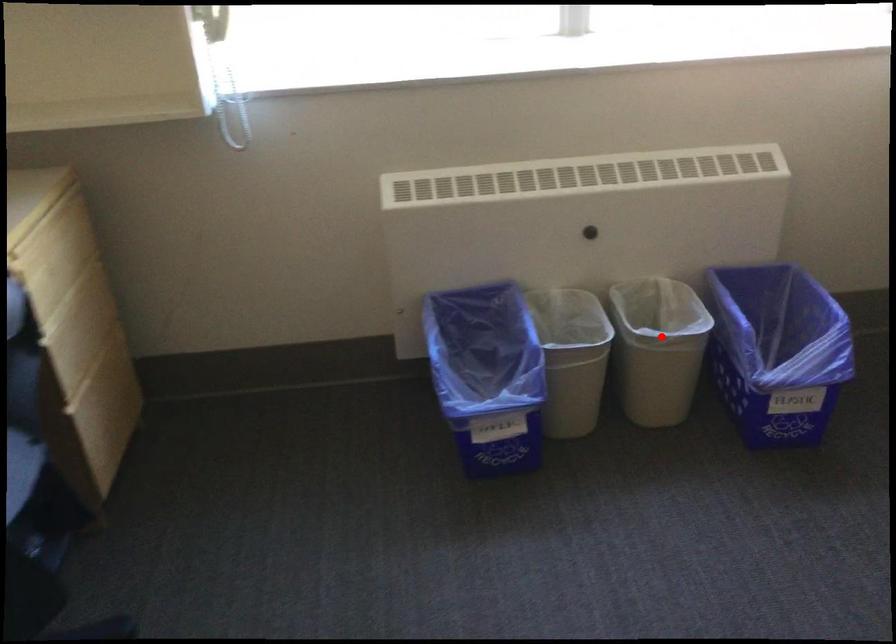
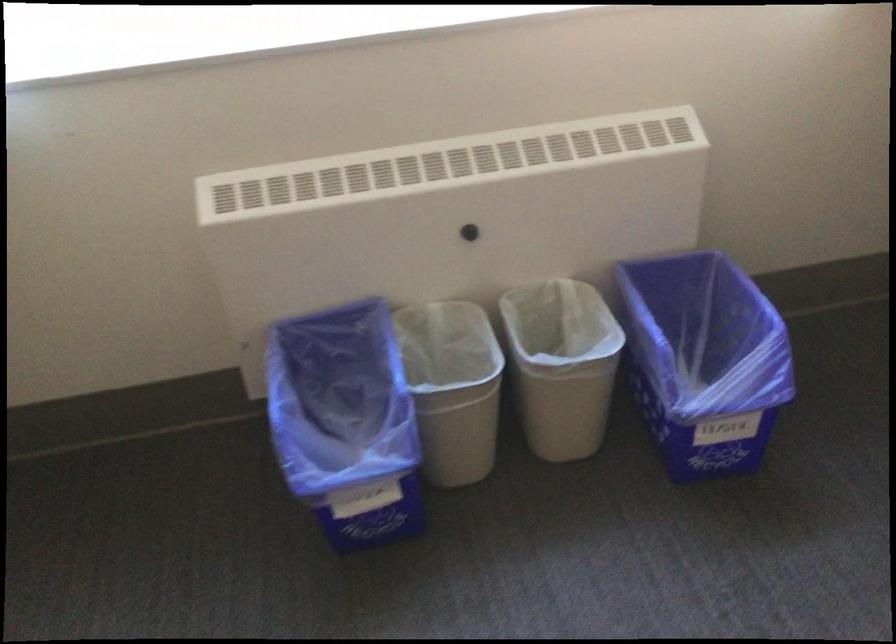
Find the pixel in the second image that matches the highlighted location in the first image.

(561, 365)